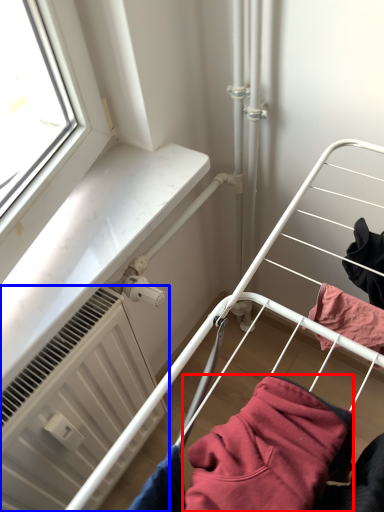
Question: Which point is closer to the camera, clothing (highlighted by a red box) or radiator (highlighted by a blue box)?

Choices:
 (A) clothing
 (B) radiator

Answer: (A)